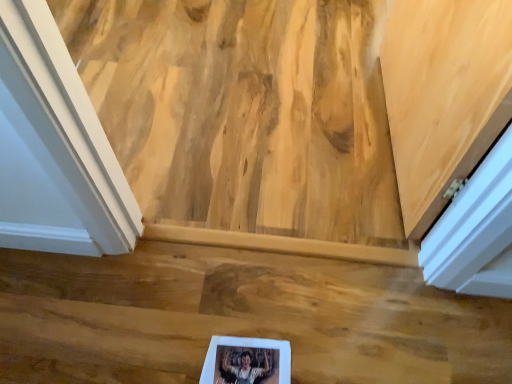
Question: From the image's perspective, is white matte picture frame at lower center positioned above or below wooden floor at center?

Choices:
 (A) below
 (B) above

Answer: (A)

Question: Is white matte picture frame at lower center in front of or behind wooden floor at center in the image?

Choices:
 (A) behind
 (B) front

Answer: (B)

Question: Considering the positions of white matte picture frame at lower center and wooden floor at center in the image, is white matte picture frame at lower center taller or shorter than wooden floor at center?

Choices:
 (A) tall
 (B) short

Answer: (B)

Question: From the image's perspective, is wooden floor at center positioned above or below white matte picture frame at lower center?

Choices:
 (A) below
 (B) above

Answer: (B)

Question: From a real-world perspective, is wooden floor at center positioned above or below white matte picture frame at lower center?

Choices:
 (A) above
 (B) below

Answer: (A)

Question: Considering their positions, is wooden floor at center located in front of or behind white matte picture frame at lower center?

Choices:
 (A) behind
 (B) front

Answer: (A)

Question: Is wooden floor at center spatially inside white matte picture frame at lower center, or outside of it?

Choices:
 (A) inside
 (B) outside

Answer: (B)